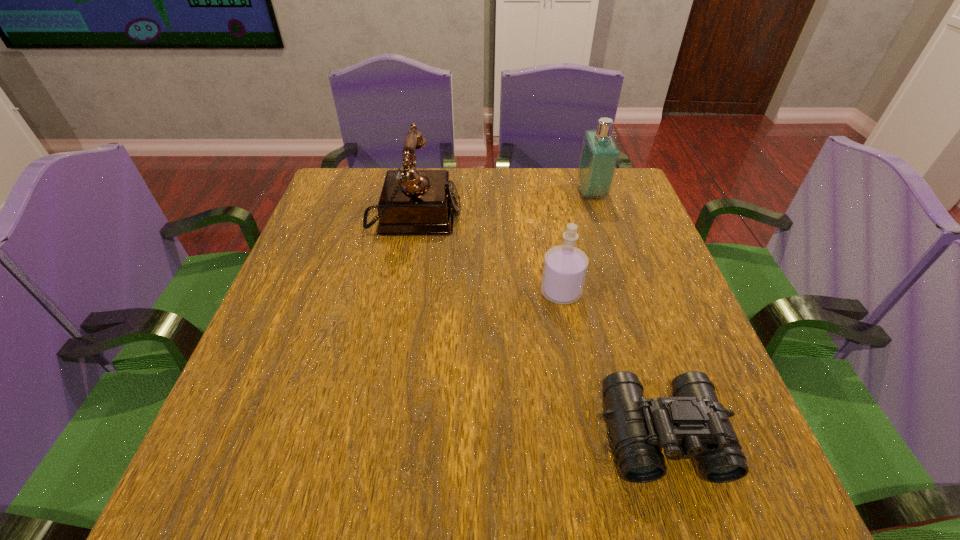
Where is `object located in the near right corner section of the desktop`? The height and width of the screenshot is (540, 960). object located in the near right corner section of the desktop is located at coordinates (692, 424).

Find the location of a particular element. This screenshot has width=960, height=540. vacant region at the far edge of the desktop is located at coordinates (453, 179).

Find the location of `vacant space at the left edge of the desktop`. vacant space at the left edge of the desktop is located at coordinates (259, 355).

Locate an element on the screen. The image size is (960, 540). blank space at the right edge of the desktop is located at coordinates (665, 281).

Find the location of a particular element. free space that is in between the right perfume and the binoculars is located at coordinates (627, 314).

Locate an element on the screen. Image resolution: width=960 pixels, height=540 pixels. free space between the shorter perfume and the telephone is located at coordinates (487, 255).

Where is `free space between the left perfume and the leftmost object`? free space between the left perfume and the leftmost object is located at coordinates (487, 255).

Where is `vacant point located between the nearest object and the taller perfume`? This screenshot has width=960, height=540. vacant point located between the nearest object and the taller perfume is located at coordinates pos(627,314).

Find the location of `vacant space in between the taller perfume and the binoculars`. vacant space in between the taller perfume and the binoculars is located at coordinates (627, 314).

Find the location of a particular element. unoccupied position between the leftmost object and the farther perfume is located at coordinates (502, 206).